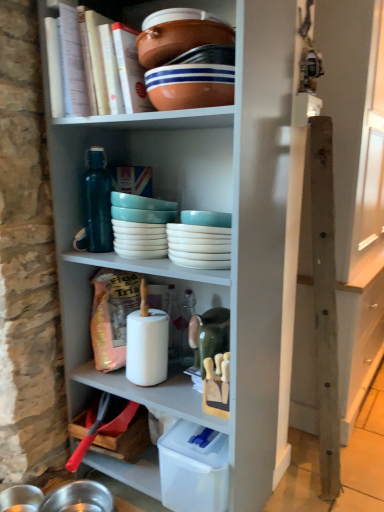
Question: Considering their positions, is brown ceramic bowl at upper center, the 2th bowl when ordered from bottom to top, located in front of or behind matte ceramic bowl at upper center, which appears as the first bowl when ordered from the bottom?

Choices:
 (A) front
 (B) behind

Answer: (A)

Question: In terms of width, does brown ceramic bowl at upper center, the 1th bowl when ordered from top to bottom, look wider or thinner when compared to matte ceramic bowl at upper center, positioned as the second bowl in top-to-bottom order?

Choices:
 (A) thin
 (B) wide

Answer: (A)

Question: Which of these objects is positioned farthest from the wooden post at right?

Choices:
 (A) matte ceramic bowl at upper center, which appears as the first bowl when ordered from the bottom
 (B) brown ceramic bowl at upper center, the 1th bowl when ordered from top to bottom
 (C) hardcover book at upper center
 (D) white glossy bowls at center, the 2th tableware viewed from the left
 (E) white glossy plates at center, the first tableware positioned from the left

Answer: (C)

Question: Estimate the real-world distances between objects in this image. Which object is closer to the brown ceramic bowl at upper center, the 1th bowl when ordered from top to bottom?

Choices:
 (A) matte ceramic bowl at upper center, which appears as the first bowl when ordered from the bottom
 (B) white glossy bowls at center, the 1th tableware viewed from the right
 (C) white glossy plates at center, the first tableware positioned from the left
 (D) wooden post at right
 (E) hardcover book at upper center

Answer: (A)